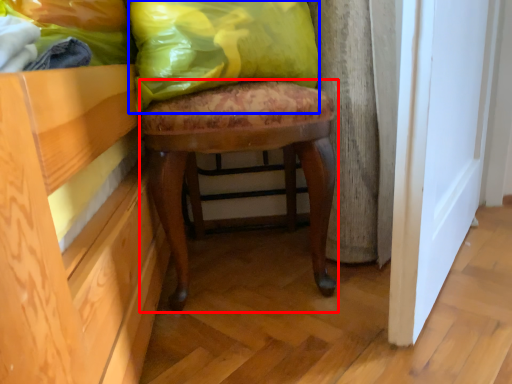
Question: Which object appears farthest to the camera in this image, stool (highlighted by a red box) or throw pillow (highlighted by a blue box)?

Choices:
 (A) stool
 (B) throw pillow

Answer: (A)